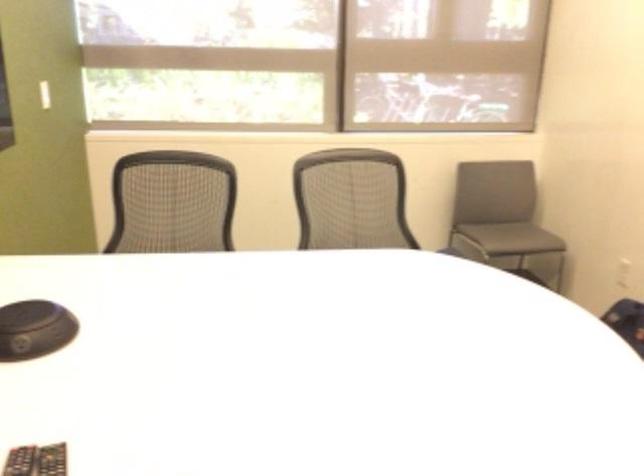
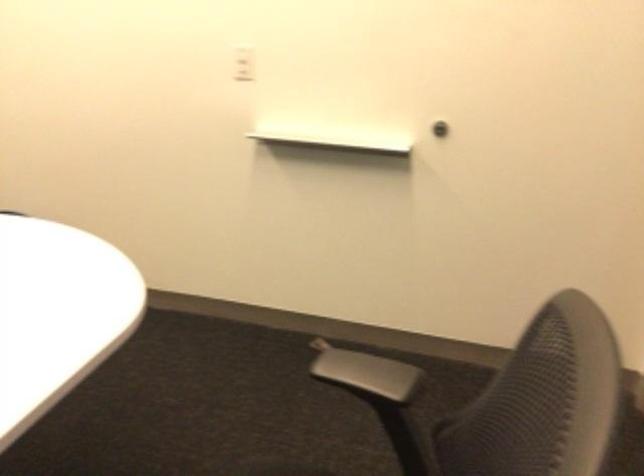
Based on the continuous images, in which direction is the camera rotating?

The camera's rotation is toward right-down.